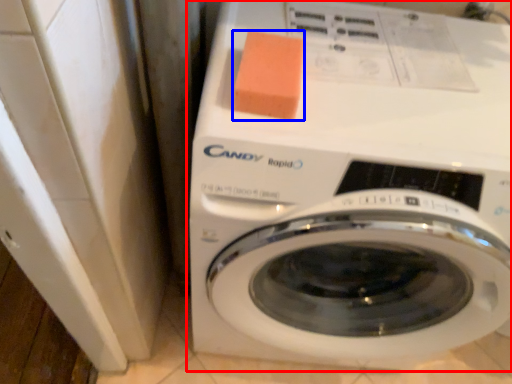
Question: Which object is closer to the camera taking this photo, washing machine (highlighted by a red box) or soap (highlighted by a blue box)?

Choices:
 (A) washing machine
 (B) soap

Answer: (A)